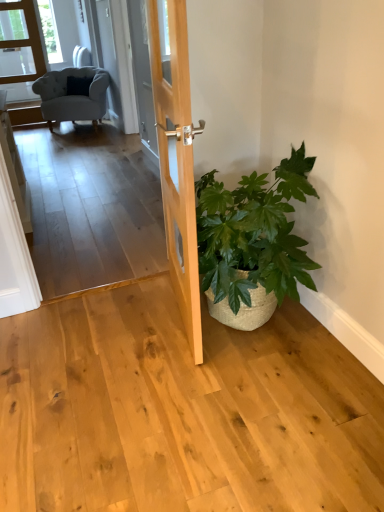
Identify the location of vacant area in front of green woven basket at lower right. Image resolution: width=384 pixels, height=512 pixels. (258, 413).